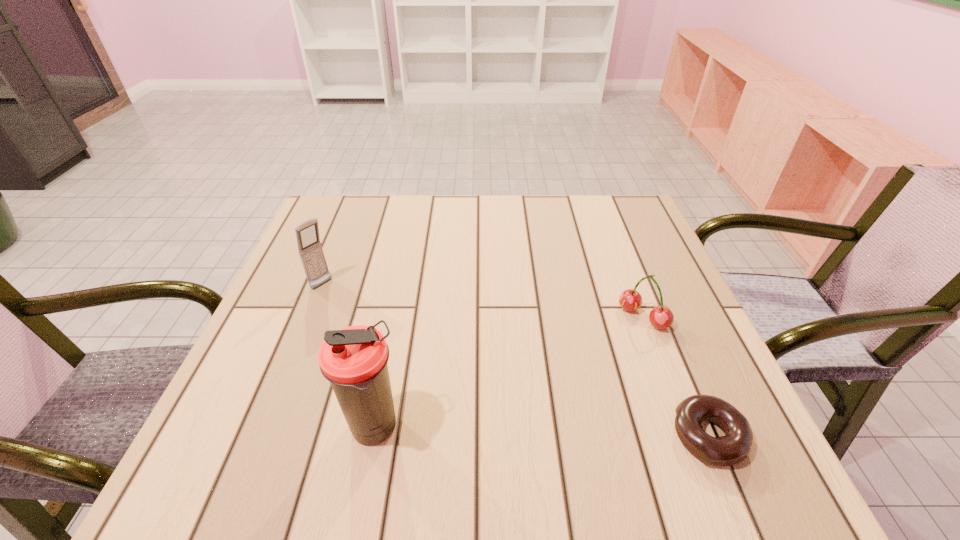
Identify the location of free point that satisfies the following two spatial constraints: 1. on the front side of the third nearest object; 2. on the right side of the doughnut. This screenshot has width=960, height=540. (688, 435).